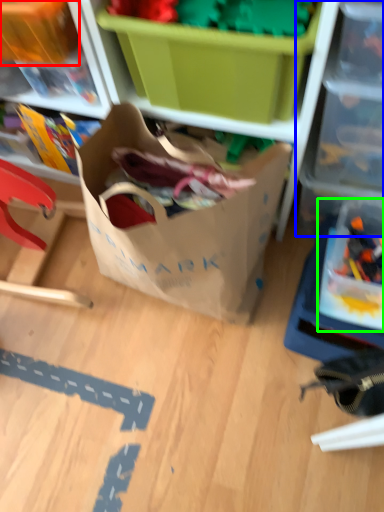
Question: Which object is positioned closest to storage box (highlighted by a red box)? Select from shelf (highlighted by a blue box) and storage box (highlighted by a green box).

Choices:
 (A) shelf
 (B) storage box

Answer: (A)